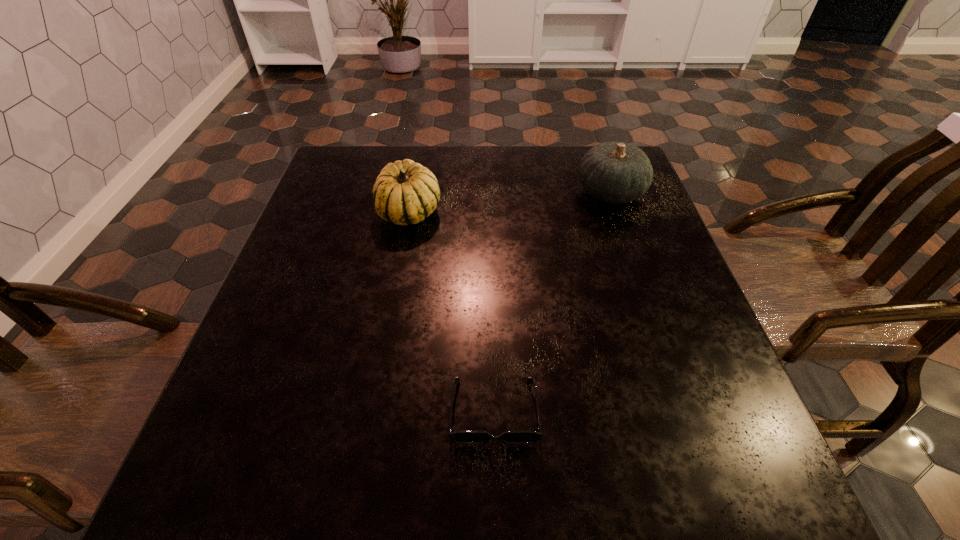
This screenshot has height=540, width=960. Identify the location of empty location between the nearest object and the leftmost object. (451, 311).

I want to click on unoccupied area between the left gourd and the rightmost object, so click(510, 202).

What are the coordinates of `vacant space that's between the right gourd and the shortest object` in the screenshot? It's located at (552, 302).

Where is `free area in between the shortest object and the leftmost object`? The height and width of the screenshot is (540, 960). free area in between the shortest object and the leftmost object is located at coordinates (451, 311).

This screenshot has height=540, width=960. I want to click on free point between the sunglasses and the right gourd, so click(552, 302).

Locate an element on the screen. vacant area between the rightmost object and the nearest object is located at coordinates (552, 302).

Select which object is the second closest to the left gourd. Please provide its 2D coordinates. Your answer should be formatted as a tuple, i.e. [(x, y)], where the tuple contains the x and y coordinates of a point satisfying the conditions above.

[(458, 437)]

Locate an element on the screen. The width and height of the screenshot is (960, 540). the closest object to the rightmost object is located at coordinates (405, 192).

The image size is (960, 540). Identify the location of free point that satisfies the following two spatial constraints: 1. on the back side of the left gourd; 2. on the left side of the rightmost object. (413, 193).